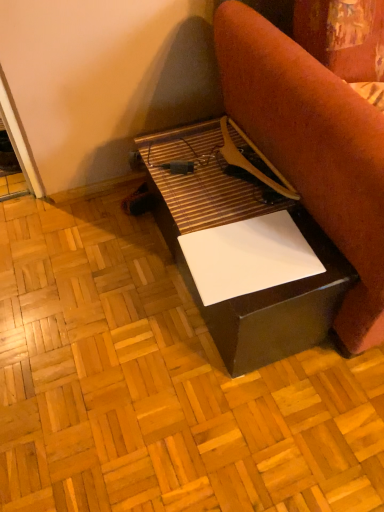
Question: In terms of size, does white glossy plywood at center appear bigger or smaller than white glossy paper at center?

Choices:
 (A) big
 (B) small

Answer: (B)

Question: Considering their positions, is white glossy plywood at center located in front of or behind white glossy paper at center?

Choices:
 (A) behind
 (B) front

Answer: (A)

Question: Which is farther from the white glossy paper at center?

Choices:
 (A) white glossy plywood at center
 (B) matte black table at center

Answer: (A)

Question: Considering the real-world distances, which object is farthest from the white glossy paper at center?

Choices:
 (A) white glossy plywood at center
 (B) matte black table at center

Answer: (A)